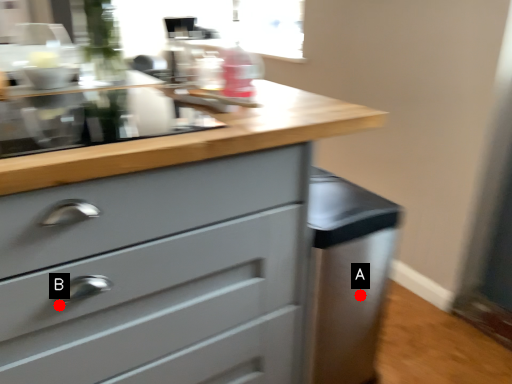
Question: Two points are circled on the image, labeled by A and B beside each circle. Among these points, which one is nearest to the camera?

Choices:
 (A) A is closer
 (B) B is closer

Answer: (B)